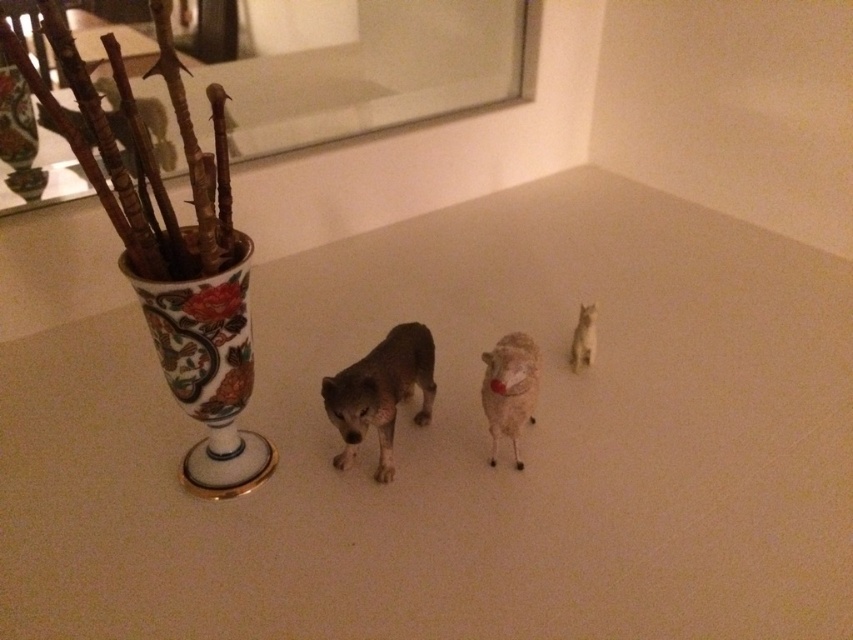
Question: Which is nearer to the porcelain vase at left?

Choices:
 (A) white matte sheep at center
 (B) shiny brown dog at center
 (C) white fur cat at right

Answer: (B)

Question: Does porcelain vase at left appear over white fur cat at right?

Choices:
 (A) yes
 (B) no

Answer: (B)

Question: Which is nearer to the porcelain vase at left?

Choices:
 (A) white fur cat at right
 (B) white matte sheep at center

Answer: (B)

Question: Can you confirm if porcelain vase at left is positioned above white fur cat at right?

Choices:
 (A) yes
 (B) no

Answer: (B)

Question: Estimate the real-world distances between objects in this image. Which object is farther from the white matte sheep at center?

Choices:
 (A) porcelain vase at left
 (B) shiny brown dog at center
 (C) white fur cat at right

Answer: (A)

Question: Is porcelain vase at left to the left of white fur cat at right from the viewer's perspective?

Choices:
 (A) no
 (B) yes

Answer: (B)